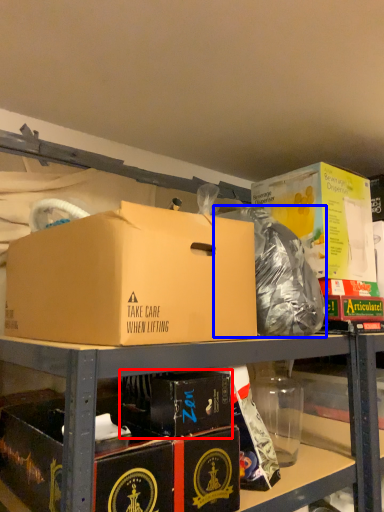
Question: Among these objects, which one is nearest to the camera, box (highlighted by a red box) or garbage (highlighted by a blue box)?

Choices:
 (A) box
 (B) garbage

Answer: (A)